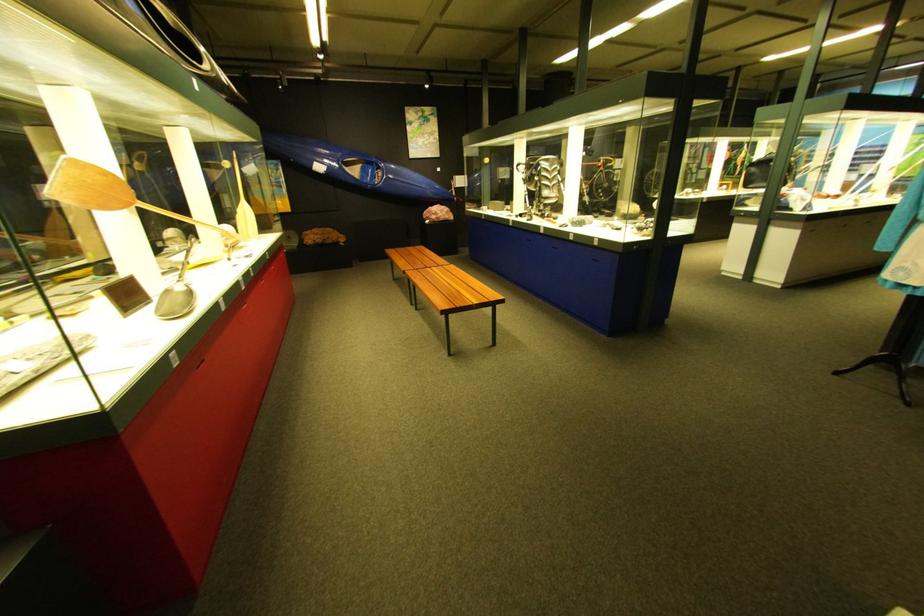
The image size is (924, 616). In order to click on blue cabinet handle in this screenshot , I will do `click(626, 246)`.